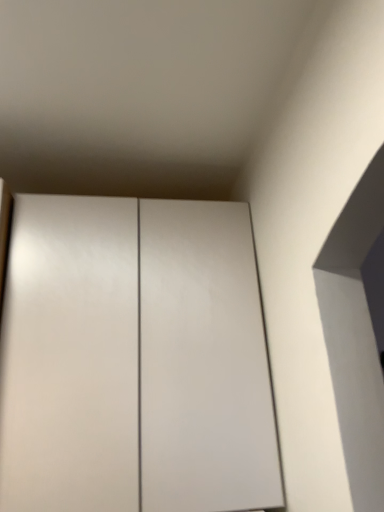
What do you see at coordinates (134, 359) in the screenshot? I see `white matte cabinet at center` at bounding box center [134, 359].

In order to click on white matte cabinet at center in this screenshot , I will do `click(134, 359)`.

This screenshot has height=512, width=384. I want to click on white matte cabinet at center, so click(x=134, y=359).